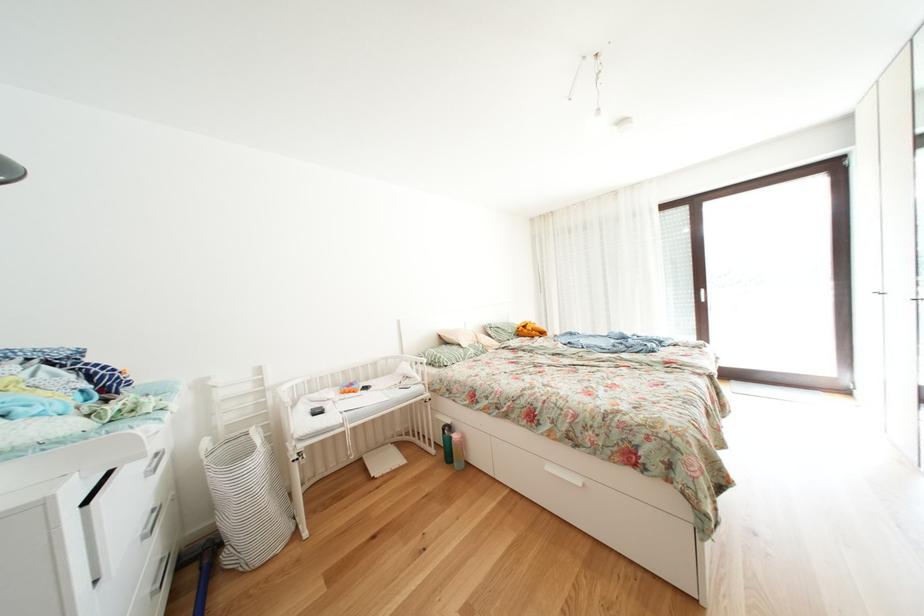
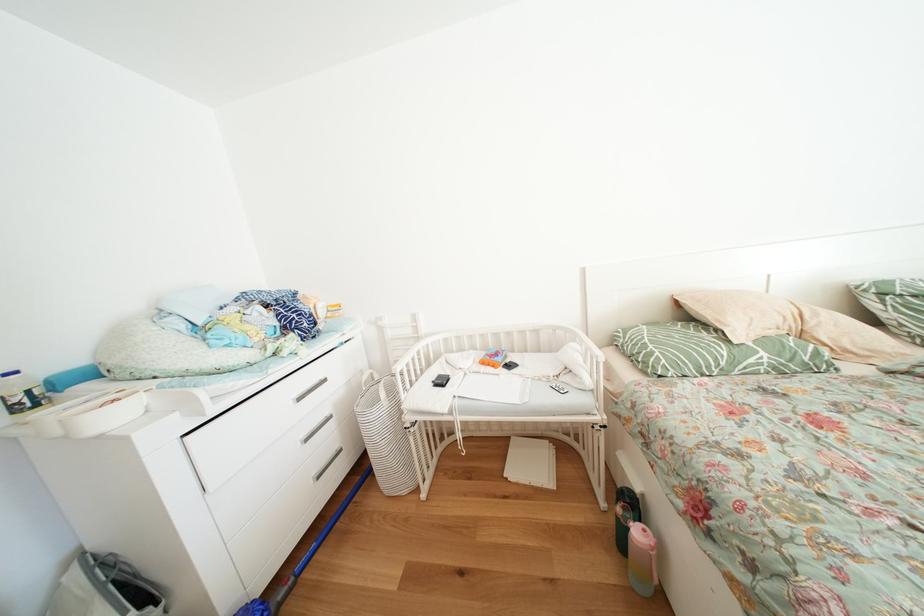
Find the pixel in the second image that matches the point at 465,440 in the first image.

(648, 538)